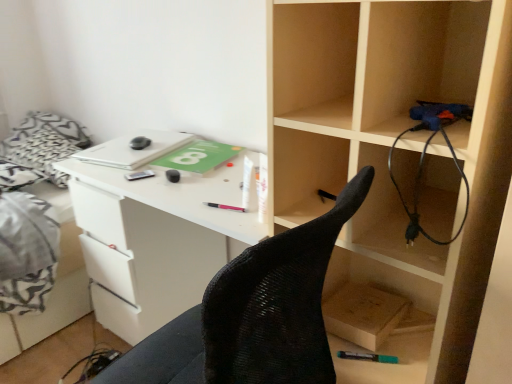
Where is `free point behind pink plastic pen at center, acting as the 2th stationery starting from the bottom`? The image size is (512, 384). free point behind pink plastic pen at center, acting as the 2th stationery starting from the bottom is located at coordinates (212, 185).